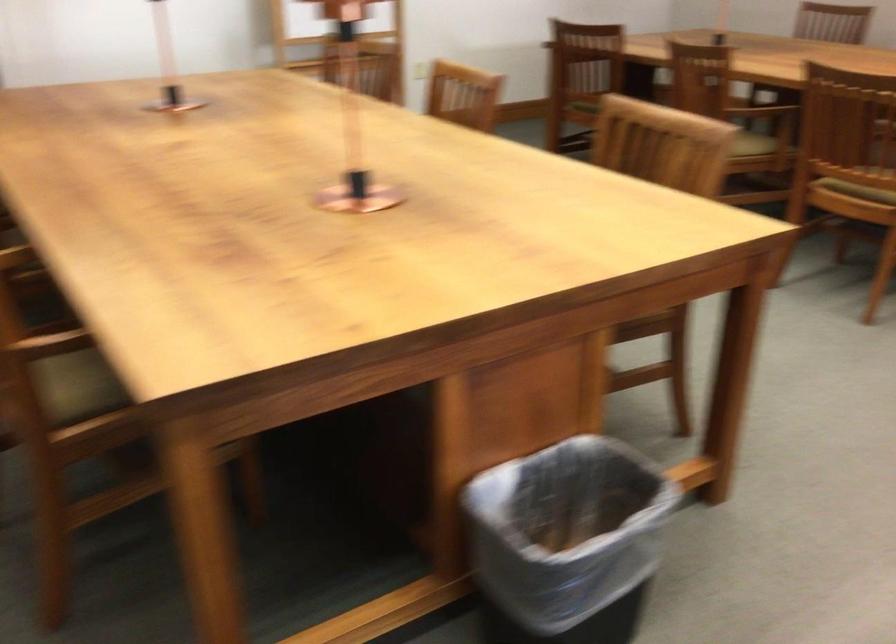
The image size is (896, 644). What do you see at coordinates (76, 386) in the screenshot?
I see `the wooden chair sitting surface` at bounding box center [76, 386].